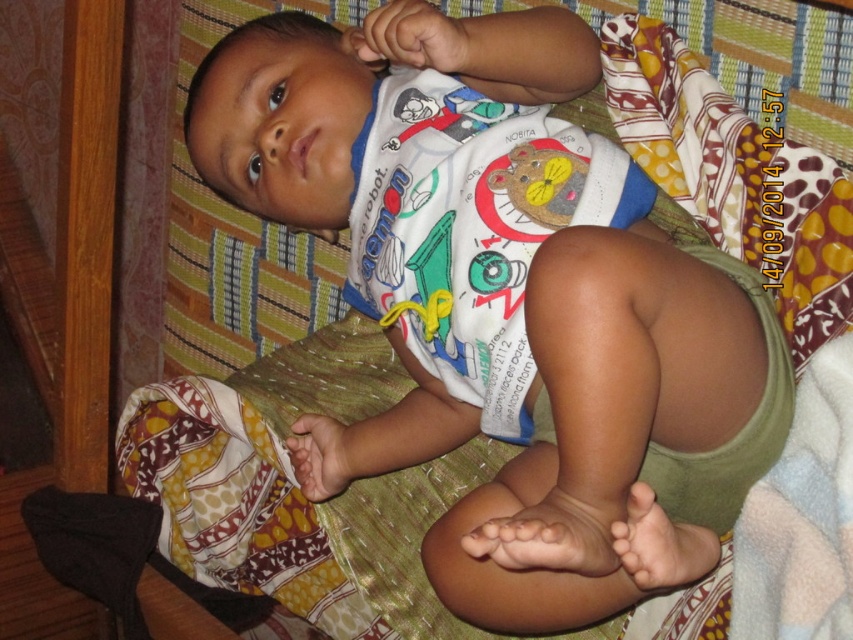
Question: Can you confirm if white cotton onesie at center is bigger than white cotton bib at center?

Choices:
 (A) yes
 (B) no

Answer: (A)

Question: Does white cotton onesie at center lie behind white cotton bib at center?

Choices:
 (A) no
 (B) yes

Answer: (A)

Question: Which point is farther from the camera taking this photo?

Choices:
 (A) (554, 182)
 (B) (438, 285)

Answer: (B)

Question: Does white cotton onesie at center have a larger size compared to white cotton bib at center?

Choices:
 (A) yes
 (B) no

Answer: (A)

Question: Which object is closer to the camera taking this photo?

Choices:
 (A) white cotton bib at center
 (B) white cotton onesie at center

Answer: (B)